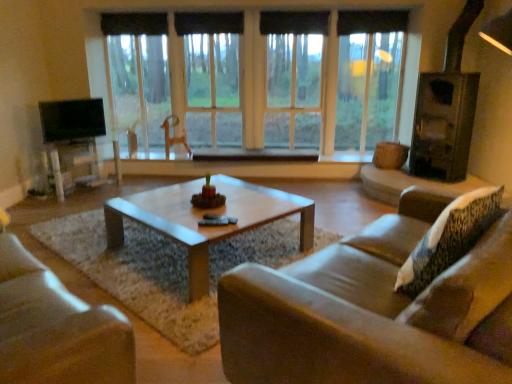
Question: Is the depth of transparent glass window at center greater than that of black fabric curtain at upper center, which is the 3th curtain from right to left?

Choices:
 (A) yes
 (B) no

Answer: (B)

Question: Can you confirm if transparent glass window at center is bigger than black fabric curtain at upper center, which is the 3th curtain from right to left?

Choices:
 (A) no
 (B) yes

Answer: (B)

Question: Is transparent glass window at center in contact with black fabric curtain at upper center, which is the 3th curtain from right to left?

Choices:
 (A) no
 (B) yes

Answer: (A)

Question: Is transparent glass window at center completely or partially outside of black fabric curtain at upper center, which is the 3th curtain from right to left?

Choices:
 (A) yes
 (B) no

Answer: (A)

Question: Considering the relative positions of transparent glass window at center and black fabric curtain at upper center, which is the 3th curtain from right to left, in the image provided, is transparent glass window at center in front of black fabric curtain at upper center, which is the 3th curtain from right to left,?

Choices:
 (A) no
 (B) yes

Answer: (B)

Question: Does transparent glass window at center have a lesser height compared to black fabric curtain at upper center, which is the 3th curtain from right to left?

Choices:
 (A) yes
 (B) no

Answer: (B)

Question: From the image's perspective, is leather couch at lower left, placed as the second studio couch when sorted from right to left, under brown leather couch at center, positioned as the 2th studio couch in left-to-right order?

Choices:
 (A) no
 (B) yes

Answer: (B)

Question: Is leather couch at lower left, placed as the second studio couch when sorted from right to left, oriented away from brown leather couch at center, which appears as the first studio couch when viewed from the right?

Choices:
 (A) yes
 (B) no

Answer: (B)

Question: Is leather couch at lower left, placed as the second studio couch when sorted from right to left, placed right next to brown leather couch at center, which appears as the first studio couch when viewed from the right?

Choices:
 (A) yes
 (B) no

Answer: (B)

Question: Could brown leather couch at center, positioned as the 2th studio couch in left-to-right order, be considered to be inside leather couch at lower left, placed as the second studio couch when sorted from right to left?

Choices:
 (A) no
 (B) yes

Answer: (A)

Question: From a real-world perspective, is leather couch at lower left, the first studio couch viewed from the left, on top of brown leather couch at center, positioned as the 2th studio couch in left-to-right order?

Choices:
 (A) no
 (B) yes

Answer: (A)

Question: Could you tell me if leather couch at lower left, placed as the second studio couch when sorted from right to left, is facing brown leather couch at center, which appears as the first studio couch when viewed from the right?

Choices:
 (A) yes
 (B) no

Answer: (A)

Question: From the image's perspective, does matte white entertainment center at left appear lower than leather couch at lower left, the first studio couch viewed from the left?

Choices:
 (A) yes
 (B) no

Answer: (B)